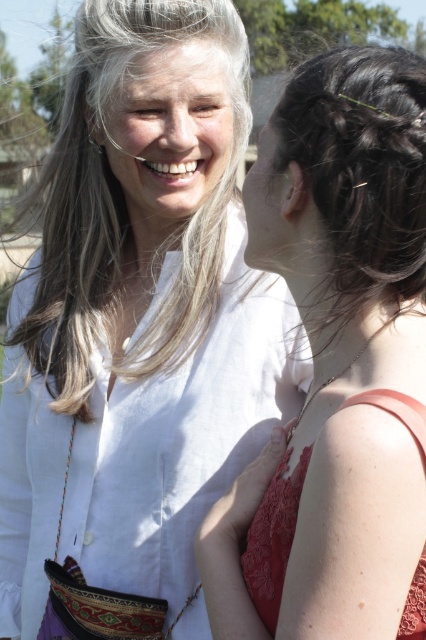
Who is positioned more to the left, white cotton shirt at upper left or matte white blouse at upper left?

white cotton shirt at upper left

Does white cotton shirt at upper left come in front of matte white blouse at upper left?

That is False.

Does point (92, 500) lie behind point (230, 557)?

Yes, point (92, 500) is farther from viewer.

Find the location of a particular element. This screenshot has height=640, width=426. white cotton shirt at upper left is located at coordinates (138, 317).

Can you confirm if smooth skin face at center is taller than matte skin nose at center?

Correct, smooth skin face at center is much taller as matte skin nose at center.

Measure the distance between point (261, 148) and camera.

A distance of 2.60 meters exists between point (261, 148) and camera.

Identify the location of smooth skin face at center. The image size is (426, 640). (267, 205).

Between point (201, 144) and point (394, 413), which one is positioned in front?

Point (394, 413) is in front.

Identify the location of smooth white face at upper center. The height and width of the screenshot is (640, 426). point(170,131).